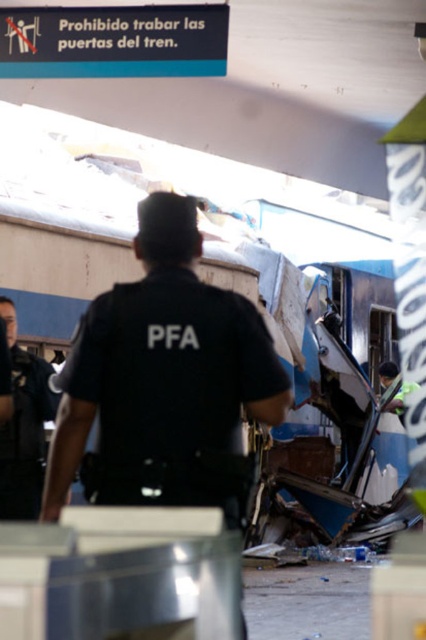
Question: Is black uniform at center smaller than dark blue uniform at left?

Choices:
 (A) yes
 (B) no

Answer: (B)

Question: Can you confirm if black uniform at center is bigger than dark blue uniform at left?

Choices:
 (A) yes
 (B) no

Answer: (A)

Question: Which point is farther from the camera taking this photo?

Choices:
 (A) (26, 490)
 (B) (288, 394)

Answer: (A)

Question: Is black uniform at center further to camera compared to dark blue uniform at left?

Choices:
 (A) no
 (B) yes

Answer: (A)

Question: Among these objects, which one is farthest from the camera?

Choices:
 (A) black uniform at center
 (B) dark blue uniform at left

Answer: (B)

Question: Which of the following is the farthest from the observer?

Choices:
 (A) (118, 449)
 (B) (31, 369)

Answer: (B)